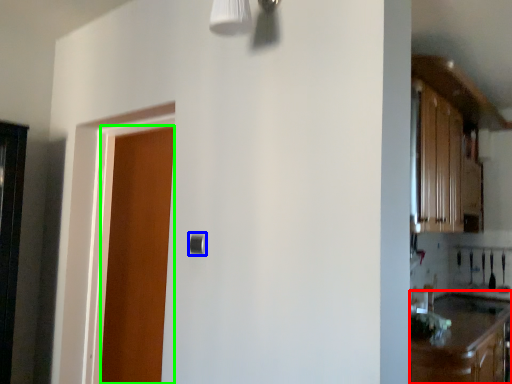
Question: Estimate the real-world distances between objects in this image. Which object is closer to cabinetry (highlighted by a red box), door handle (highlighted by a blue box) or door (highlighted by a green box)?

Choices:
 (A) door handle
 (B) door

Answer: (A)